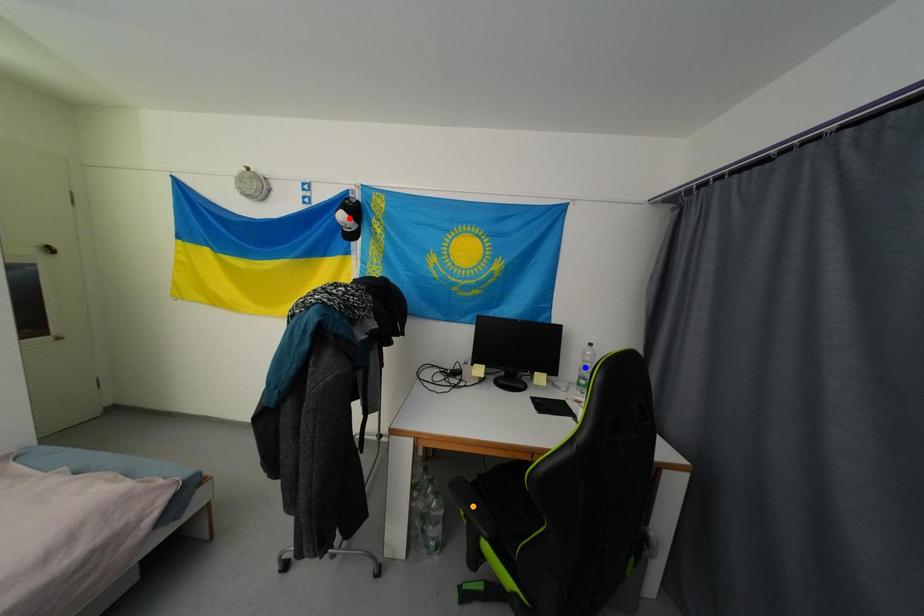
Order these from nearest to farthest:
red point
blue point
orange point

orange point
blue point
red point